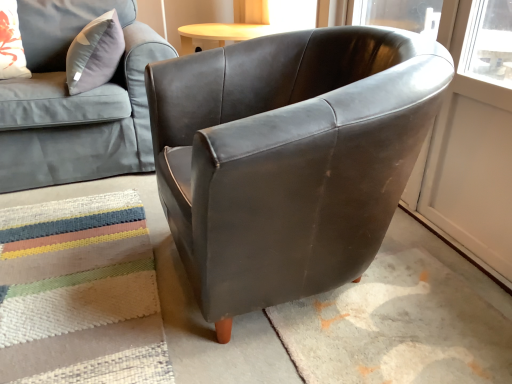
Question: Is floral fabric pillow at upper left directly adjacent to textured woven mat at lower left?

Choices:
 (A) yes
 (B) no

Answer: (B)

Question: Does floral fabric pillow at upper left appear on the right side of textured woven mat at lower left?

Choices:
 (A) no
 (B) yes

Answer: (A)

Question: Is floral fabric pillow at upper left looking in the opposite direction of textured woven mat at lower left?

Choices:
 (A) no
 (B) yes

Answer: (A)

Question: Can you confirm if floral fabric pillow at upper left is shorter than textured woven mat at lower left?

Choices:
 (A) no
 (B) yes

Answer: (A)

Question: Does floral fabric pillow at upper left turn towards textured woven mat at lower left?

Choices:
 (A) yes
 (B) no

Answer: (A)

Question: From a real-world perspective, is floral fabric pillow at upper left positioned over textured woven mat at lower left based on gravity?

Choices:
 (A) no
 (B) yes

Answer: (B)

Question: Is floral fabric pillow at upper left located outside matte gray fabric couch at upper left?

Choices:
 (A) no
 (B) yes

Answer: (A)

Question: Is floral fabric pillow at upper left oriented towards matte gray fabric couch at upper left?

Choices:
 (A) no
 (B) yes

Answer: (B)

Question: Is floral fabric pillow at upper left at the left side of matte gray fabric couch at upper left?

Choices:
 (A) yes
 (B) no

Answer: (A)

Question: Is floral fabric pillow at upper left beside matte gray fabric couch at upper left?

Choices:
 (A) no
 (B) yes

Answer: (A)

Question: Is floral fabric pillow at upper left at the right side of matte gray fabric couch at upper left?

Choices:
 (A) no
 (B) yes

Answer: (A)

Question: Does floral fabric pillow at upper left come behind matte gray fabric couch at upper left?

Choices:
 (A) yes
 (B) no

Answer: (A)

Question: From the image's perspective, would you say matte gray fabric couch at upper left is positioned over matte brown leather armchair at center?

Choices:
 (A) no
 (B) yes

Answer: (B)